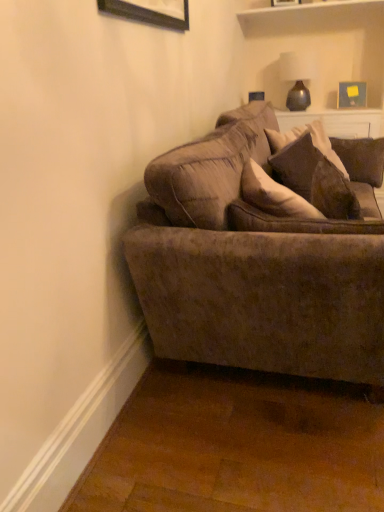
What do you see at coordinates (284, 2) in the screenshot? The image size is (384, 512). I see `wooden picture frame at upper center, positioned as the 1th picture frame in left-to-right order` at bounding box center [284, 2].

Locate an element on the screen. Image resolution: width=384 pixels, height=512 pixels. wooden picture frame at upper right, acting as the second picture frame starting from the top is located at coordinates [x=352, y=95].

The height and width of the screenshot is (512, 384). What are the coordinates of `matte brown vase at upper right` in the screenshot? It's located at (297, 78).

The image size is (384, 512). Find the location of `velvet brown couch at center`. velvet brown couch at center is located at coordinates (262, 256).

Would you say wooden picture frame at upper center, positioned as the 1th picture frame in left-to-right order, is part of matte brown vase at upper right's contents?

Definitely not — wooden picture frame at upper center, positioned as the 1th picture frame in left-to-right order, is not inside matte brown vase at upper right.

Considering the points (299, 77) and (287, 1), which point is in front, point (299, 77) or point (287, 1)?

The point (287, 1) is more forward.

Considering the sizes of objects matte brown vase at upper right and wooden picture frame at upper center, arranged as the second picture frame when ordered from the bottom, in the image provided, who is bigger, matte brown vase at upper right or wooden picture frame at upper center, arranged as the second picture frame when ordered from the bottom,?

Bigger between the two is matte brown vase at upper right.

Where is `lamp to the right of wooden picture frame at upper center, the first picture frame from the front`? This screenshot has width=384, height=512. lamp to the right of wooden picture frame at upper center, the first picture frame from the front is located at coordinates (297, 78).

Do you think velvet brown pillow at upper right is within velvet brown couch at center, or outside of it?

velvet brown pillow at upper right lies within the bounds of velvet brown couch at center.

Which object is wider, velvet brown pillow at upper right or velvet brown couch at center?

velvet brown couch at center is wider.

Is velvet brown pillow at upper right taller or shorter than velvet brown couch at center?

Clearly, velvet brown pillow at upper right is shorter compared to velvet brown couch at center.

Considering the relative sizes of wooden picture frame at upper center, arranged as the second picture frame when ordered from the bottom, and matte brown vase at upper right in the image provided, is wooden picture frame at upper center, arranged as the second picture frame when ordered from the bottom, smaller than matte brown vase at upper right?

Yes, wooden picture frame at upper center, arranged as the second picture frame when ordered from the bottom, is smaller than matte brown vase at upper right.

Which is more to the right, wooden picture frame at upper center, the second picture frame positioned from the right, or matte brown vase at upper right?

matte brown vase at upper right is more to the right.

From a real-world perspective, who is located lower, wooden picture frame at upper center, placed as the 2th picture frame when sorted from back to front, or matte brown vase at upper right?

In real-world perspective, matte brown vase at upper right is lower.

Is velvet brown couch at center inside or outside of matte brown vase at upper right?

velvet brown couch at center is not inside matte brown vase at upper right, it's outside.

From the image's perspective, which object appears higher, velvet brown couch at center or matte brown vase at upper right?

From the image's view, matte brown vase at upper right is above.

Is velvet brown couch at center looking in the opposite direction of matte brown vase at upper right?

That's not correct — velvet brown couch at center is not looking away from matte brown vase at upper right.

From the image's perspective, is wooden picture frame at upper center, arranged as the second picture frame when ordered from the bottom, on top of velvet brown pillow at upper right?

Yes, from the image's perspective, wooden picture frame at upper center, arranged as the second picture frame when ordered from the bottom, is over velvet brown pillow at upper right.

Is wooden picture frame at upper center, the first picture frame from the front, to the right of velvet brown pillow at upper right from the viewer's perspective?

Correct, you'll find wooden picture frame at upper center, the first picture frame from the front, to the right of velvet brown pillow at upper right.

Which is closer, [286,5] or [298,149]?

The point [298,149] is more forward.

Is wooden picture frame at upper center, arranged as the second picture frame when ordered from the bottom, completely or partially outside of velvet brown pillow at upper right?

Yes, wooden picture frame at upper center, arranged as the second picture frame when ordered from the bottom, is located beyond the bounds of velvet brown pillow at upper right.

What's the angular difference between velvet brown couch at center and wooden picture frame at upper right, the first picture frame ordered from the bottom,'s facing directions?

velvet brown couch at center and wooden picture frame at upper right, the first picture frame ordered from the bottom, are facing 89.9 degrees away from each other.

Does velvet brown couch at center have a smaller size compared to wooden picture frame at upper right, the 1th picture frame viewed from the right?

Actually, velvet brown couch at center might be larger than wooden picture frame at upper right, the 1th picture frame viewed from the right.

In terms of width, does velvet brown couch at center look wider or thinner when compared to wooden picture frame at upper right, the first picture frame ordered from the bottom?

In the image, velvet brown couch at center appears to be wider than wooden picture frame at upper right, the first picture frame ordered from the bottom.

Is velvet brown couch at center located outside wooden picture frame at upper right, which is the 2th picture frame in front-to-back order?

That's correct, velvet brown couch at center is outside of wooden picture frame at upper right, which is the 2th picture frame in front-to-back order.

Based on the photo, is matte brown vase at upper right to the left of velvet brown pillow at upper right from the viewer's perspective?

No.

Is matte brown vase at upper right aimed at velvet brown pillow at upper right?

Yes, matte brown vase at upper right is oriented towards velvet brown pillow at upper right.

Would you say matte brown vase at upper right is outside velvet brown pillow at upper right?

Yes, matte brown vase at upper right is outside of velvet brown pillow at upper right.

Is matte brown vase at upper right positioned far away from velvet brown pillow at upper right?

matte brown vase at upper right is far away from velvet brown pillow at upper right.

This screenshot has width=384, height=512. Identify the location of picture frame above the matte brown vase at upper right (from a real-world perspective). (284, 2).

In the image, there is a velvet brown pillow at upper right. In order to click on studio couch below it (from the image's perspective) in this screenshot , I will do `click(262, 256)`.

Which object lies further to the anchor point matte brown vase at upper right, wooden picture frame at upper right, acting as the second picture frame starting from the top, or velvet brown couch at center?

velvet brown couch at center is positioned further to the anchor matte brown vase at upper right.

Based on their spatial positions, is wooden picture frame at upper right, which appears as the 1th picture frame when viewed from the back, or velvet brown pillow at upper right closer to wooden picture frame at upper center, the second picture frame positioned from the right?

wooden picture frame at upper right, which appears as the 1th picture frame when viewed from the back, is closer to wooden picture frame at upper center, the second picture frame positioned from the right.

From the image, which object appears to be nearer to wooden picture frame at upper center, positioned as the 1th picture frame in left-to-right order, wooden picture frame at upper right, the 1th picture frame viewed from the right, or matte brown vase at upper right?

matte brown vase at upper right lies closer to wooden picture frame at upper center, positioned as the 1th picture frame in left-to-right order, than the other object.

Considering their positions, is wooden picture frame at upper center, placed as the 2th picture frame when sorted from back to front, positioned closer to wooden picture frame at upper right, which appears as the 1th picture frame when viewed from the back, than velvet brown couch at center?

Based on the image, wooden picture frame at upper center, placed as the 2th picture frame when sorted from back to front, appears to be nearer to wooden picture frame at upper right, which appears as the 1th picture frame when viewed from the back.

When comparing their distances from velvet brown pillow at upper right, does wooden picture frame at upper right, the first picture frame ordered from the bottom, or wooden picture frame at upper center, which ranks as the first picture frame in top-to-bottom order, seem further?

Among the two, wooden picture frame at upper center, which ranks as the first picture frame in top-to-bottom order, is located further to velvet brown pillow at upper right.

From the image, which object appears to be nearer to wooden picture frame at upper center, placed as the 2th picture frame when sorted from back to front, velvet brown pillow at upper right or matte brown vase at upper right?

Among the two, matte brown vase at upper right is located nearer to wooden picture frame at upper center, placed as the 2th picture frame when sorted from back to front.

When comparing their distances from wooden picture frame at upper right, which appears as the 1th picture frame when viewed from the back, does wooden picture frame at upper center, the second picture frame positioned from the right, or matte brown vase at upper right seem further?

wooden picture frame at upper center, the second picture frame positioned from the right.

Considering their positions, is velvet brown couch at center positioned closer to matte brown vase at upper right than wooden picture frame at upper right, the 1th picture frame viewed from the right?

wooden picture frame at upper right, the 1th picture frame viewed from the right, is positioned closer to the anchor matte brown vase at upper right.

This screenshot has width=384, height=512. Find the location of `picture frame that lies between wooden picture frame at upper center, placed as the 2th picture frame when sorted from back to front, and velvet brown pillow at upper right from top to bottom`. picture frame that lies between wooden picture frame at upper center, placed as the 2th picture frame when sorted from back to front, and velvet brown pillow at upper right from top to bottom is located at coordinates (352, 95).

Locate an element on the screen. This screenshot has width=384, height=512. lamp positioned between velvet brown pillow at upper right and wooden picture frame at upper right, the first picture frame ordered from the bottom, from near to far is located at coordinates (297, 78).

Image resolution: width=384 pixels, height=512 pixels. Identify the location of lamp positioned between velvet brown couch at center and wooden picture frame at upper right, the 1th picture frame viewed from the right, from near to far. (297, 78).

Find the location of `lamp between wooden picture frame at upper center, the second picture frame positioned from the right, and wooden picture frame at upper right, the first picture frame ordered from the bottom, vertically`. lamp between wooden picture frame at upper center, the second picture frame positioned from the right, and wooden picture frame at upper right, the first picture frame ordered from the bottom, vertically is located at coordinates (297, 78).